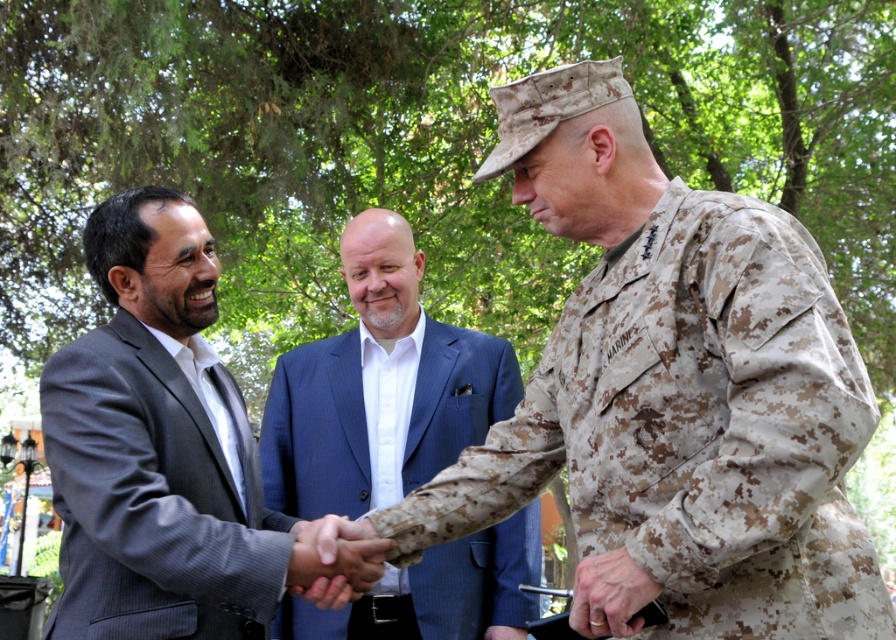
Where is `blue suit at center`? This screenshot has width=896, height=640. blue suit at center is located at coordinates (378, 388).

From the picture: Does blue suit at center lie behind smooth skin handshake at center?

That is True.

Who is more distant from viewer, (302, 387) or (320, 538)?

The point (302, 387) is behind.

The height and width of the screenshot is (640, 896). In order to click on blue suit at center in this screenshot , I will do `click(378, 388)`.

Is camouflage uniform at center above gray suit at left?

Incorrect, camouflage uniform at center is not positioned above gray suit at left.

Is point (761, 262) positioned after point (119, 618)?

No, (761, 262) is closer to viewer.

Between point (596, 592) and point (154, 404), which one is positioned in front?

Point (596, 592) is in front.

Image resolution: width=896 pixels, height=640 pixels. Identify the location of camouflage uniform at center. (672, 394).

Can you confirm if gray suit at left is smaller than smooth skin handshake at center?

Actually, gray suit at left might be larger than smooth skin handshake at center.

Can you confirm if gray suit at left is shorter than smooth skin handshake at center?

No.

Is point (293, 576) positioned before point (304, 528)?

Yes, it is in front of point (304, 528).

Where is `gray suit at left`? The width and height of the screenshot is (896, 640). gray suit at left is located at coordinates (162, 451).